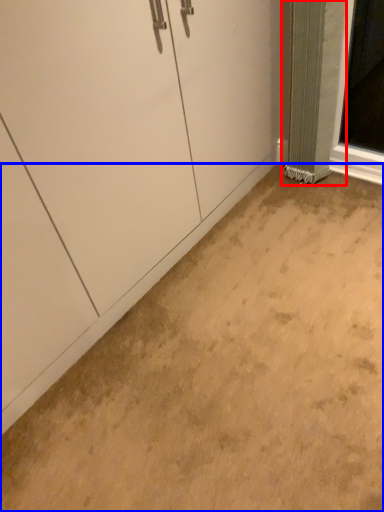
Question: Among these objects, which one is nearest to the camera, curtain (highlighted by a red box) or concrete (highlighted by a blue box)?

Choices:
 (A) curtain
 (B) concrete

Answer: (B)